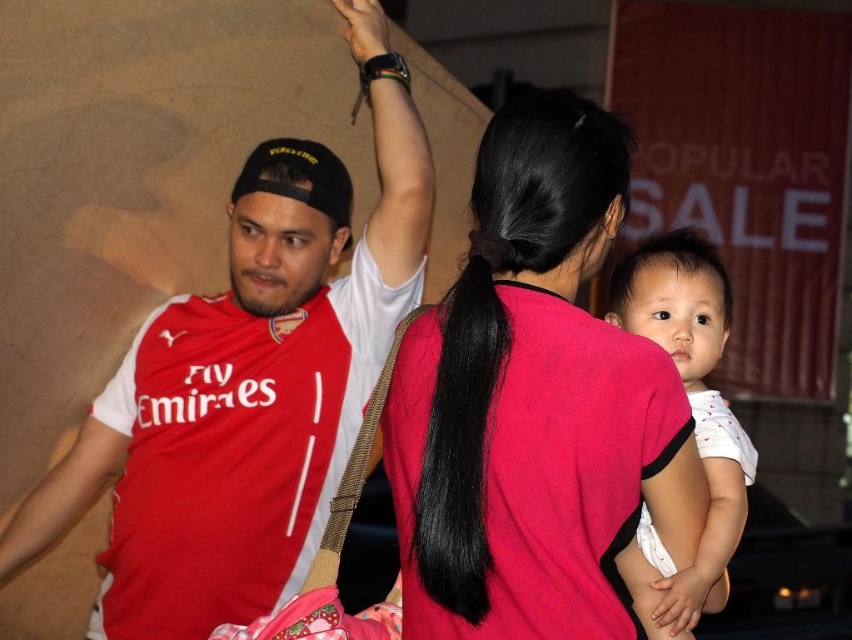
Question: Can you confirm if matte pink shirt at center is thinner than matte red jersey at left?

Choices:
 (A) yes
 (B) no

Answer: (B)

Question: Is matte jersey at center below black silky hair at center?

Choices:
 (A) yes
 (B) no

Answer: (B)

Question: Does matte jersey at center come in front of white soft fabric baby at center?

Choices:
 (A) no
 (B) yes

Answer: (A)

Question: Based on their relative distances, which object is nearer to the black leather watch at upper center?

Choices:
 (A) black silky hair at center
 (B) white soft fabric baby at center

Answer: (B)

Question: Which point is farther to the camera?

Choices:
 (A) black leather watch at upper center
 (B) black silky hair at center
 (C) matte red jersey at left
 (D) matte jersey at center

Answer: (C)

Question: Which is farther from the matte red jersey at left?

Choices:
 (A) white soft fabric baby at center
 (B) matte pink shirt at center

Answer: (A)